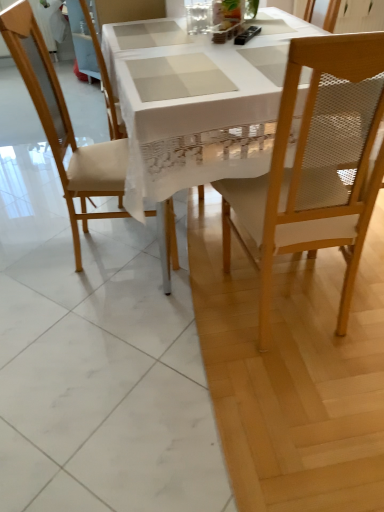
Locate an element on the screen. vacant area to the left of black plastic remote control at upper center is located at coordinates (199, 40).